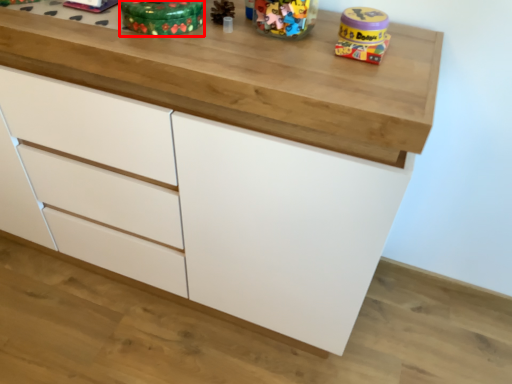
Question: From the image, what is the correct spatial relationship of toy (annotated by the red box) in relation to toy?

Choices:
 (A) left
 (B) right

Answer: (A)